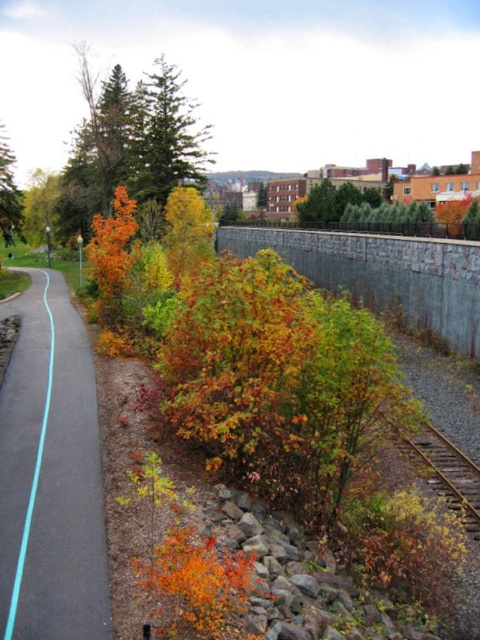
You are a gardener planning to walk along the blue asphalt path at center and the orange leafy bush at left. Which of these two objects is narrower in width?

The blue asphalt path at center is thinner than the orange leafy bush at left, so the blue asphalt path at center is narrower in width.

You are standing at the bottom left corner of the image, facing the paved pathway. There is a green matte tree at upper center marked by point (x=165, y=136). If you walk straight along the pathway, will you pass by the green matte tree at upper center before reaching the center of the image?

The point (x=165, y=136) marks the green matte tree at upper center. Since you are starting at the bottom left corner and walking straight along the pathway towards the center of the image, you will reach the center before passing by the green matte tree at upper center, which is located beyond the center point.